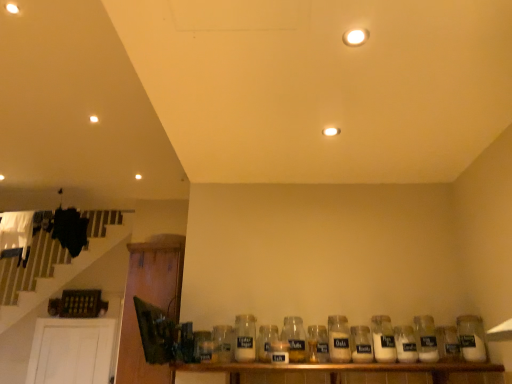
Question: From the image's perspective, is clear glass jar at center, which is the seventh bottle in right-to-left order, located above or below wooden shelf at lower center?

Choices:
 (A) above
 (B) below

Answer: (A)

Question: From a real-world perspective, is clear glass jar at center, which is the seventh bottle in right-to-left order, positioned above or below wooden shelf at lower center?

Choices:
 (A) above
 (B) below

Answer: (A)

Question: Estimate the real-world distances between objects in this image. Which object is farther from the white glass jar at center, which is counted as the sixth bottle, starting from the left?

Choices:
 (A) wooden shelf at lower center
 (B) white glass jar at lower right, arranged as the 1th bottle when viewed from the right
 (C) clear glass jar at center, the 11th bottle positioned from the right
 (D) clear glass jar at center, which is the 3th bottle from left to right
 (E) white glass bottle at center, the ninth bottle positioned from the left

Answer: (B)

Question: Estimate the real-world distances between objects in this image. Which object is farther from the clear glass jar at center, which is the 3th bottle from left to right?

Choices:
 (A) clear glass jar at center, the 7th bottle viewed from the left
 (B) white glass jar at lower right, arranged as the 1th bottle when viewed from the right
 (C) white glass jar at center, which is the 8th bottle in left-to-right order
 (D) clear glass jar at center, which is counted as the 10th bottle, starting from the right
 (E) wooden shelf at lower center

Answer: (B)